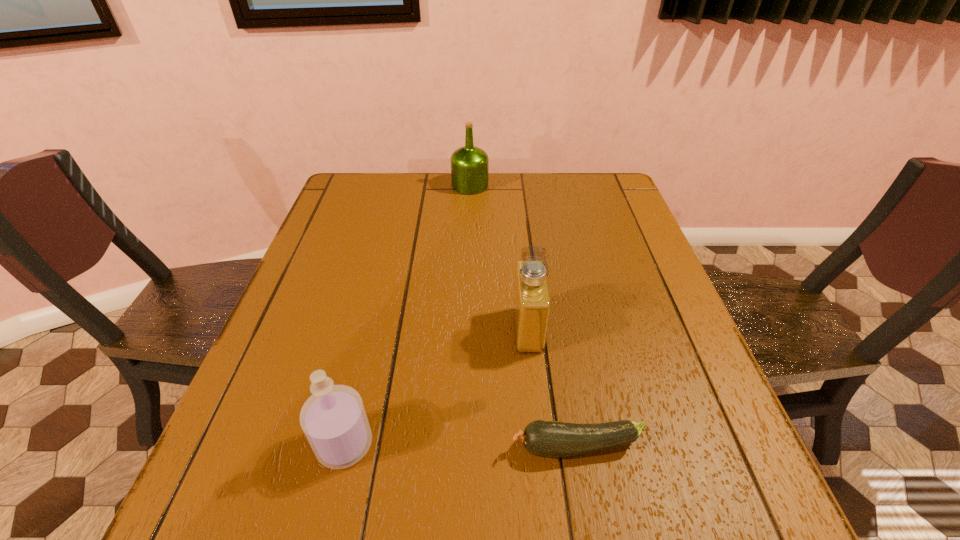
At what (x,y) coordinates should I click in order to perform the action: click on the farthest object. Please return your answer as a coordinate pair (x, y). Image resolution: width=960 pixels, height=540 pixels. Looking at the image, I should click on (469, 165).

This screenshot has height=540, width=960. Identify the location of the third object from right to left. (469, 165).

Find the location of a particular element. This screenshot has height=540, width=960. the right perfume is located at coordinates (531, 303).

Where is `the second farthest object`? the second farthest object is located at coordinates (531, 303).

Image resolution: width=960 pixels, height=540 pixels. Find the location of `the left perfume`. the left perfume is located at coordinates (333, 419).

Identify the location of the nearer perfume. (x=333, y=419).

Where is `zucchini`? zucchini is located at coordinates (551, 439).

You are a GUI agent. You are given a task and a screenshot of the screen. Output one action in this format:
    pyautogui.click(x=<x>, y=<y>)
    Task: Click on the vacant region located on the right of the farthest object
    The height and width of the screenshot is (540, 960).
    Given the screenshot: What is the action you would take?
    pyautogui.click(x=568, y=186)

Identify the location of blank area located on the front-facing side of the right perfume. This screenshot has width=960, height=540. (378, 330).

At what (x,y) coordinates should I click in order to perform the action: click on vacant space situated on the front-facing side of the right perfume. Please return your answer as a coordinate pair (x, y). Looking at the image, I should click on (383, 330).